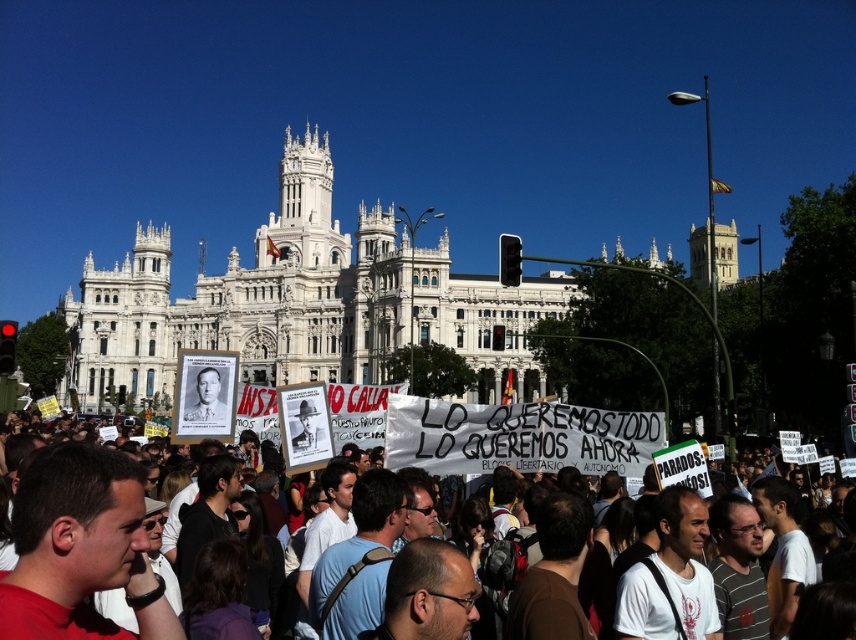
Question: Does white stone building at center appear on the left side of white paper signs at center?

Choices:
 (A) no
 (B) yes

Answer: (B)

Question: Which of the following is the closest to the observer?

Choices:
 (A) white paper signs at center
 (B) white stone building at center

Answer: (A)

Question: Is white stone building at center wider than white paper signs at center?

Choices:
 (A) no
 (B) yes

Answer: (B)

Question: Which point is farther from the camera taking this photo?

Choices:
 (A) (28, 525)
 (B) (257, 321)

Answer: (B)

Question: Is white stone building at center smaller than white paper signs at center?

Choices:
 (A) yes
 (B) no

Answer: (B)